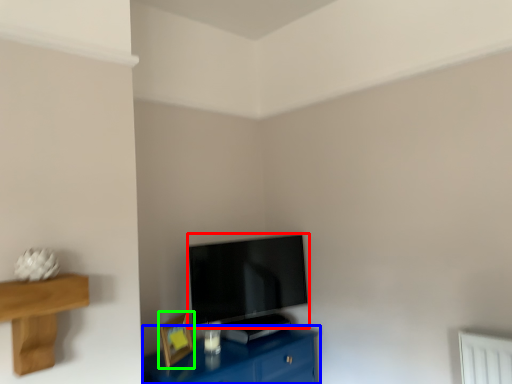
Question: Estimate the real-world distances between objects in this image. Which object is farther from television (highlighted by a red box), table (highlighted by a blue box) or picture frame (highlighted by a green box)?

Choices:
 (A) table
 (B) picture frame

Answer: (B)